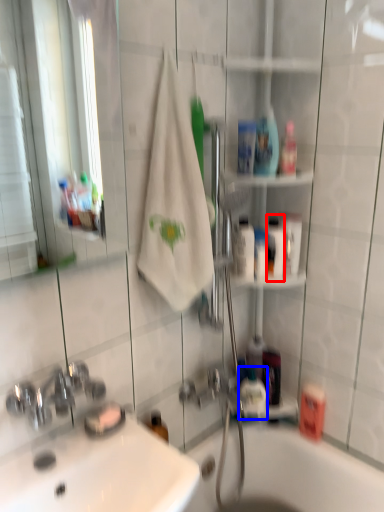
Question: Which object is further to the camera taking this photo, mouthwash (highlighted by a red box) or mouthwash (highlighted by a blue box)?

Choices:
 (A) mouthwash
 (B) mouthwash

Answer: (B)